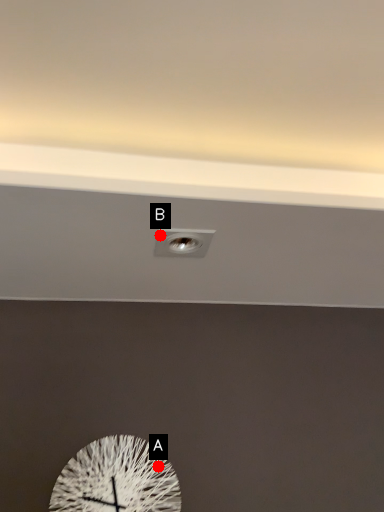
Question: Two points are circled on the image, labeled by A and B beside each circle. Which point is farther to the camera?

Choices:
 (A) A is further
 (B) B is further

Answer: (A)